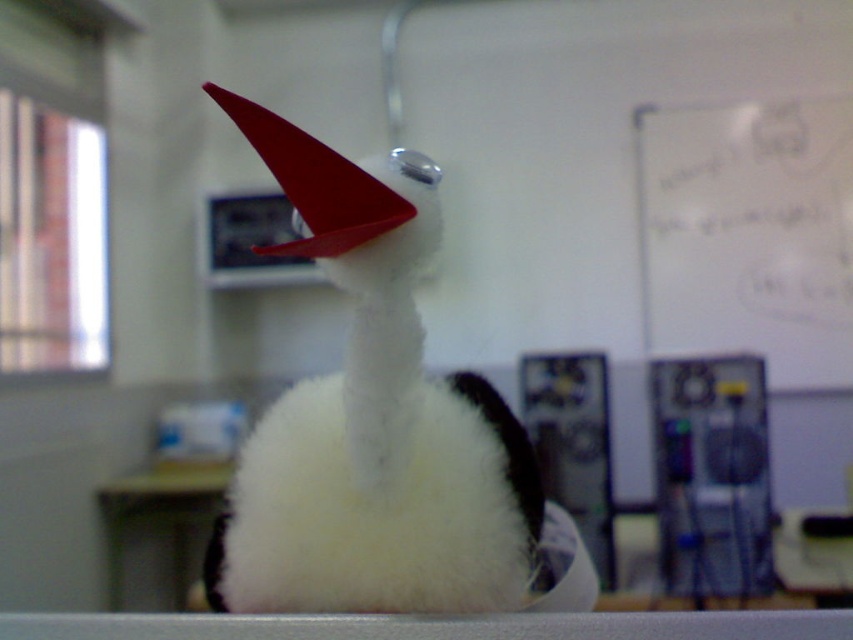
You are holding a camera and want to take a photo of the plush toy bird. The camera is currently at a position that is 17.16 inches away from the point labeled as point (460,544). Will the plush toy bird be in focus if you focus on that point?

Yes, the plush toy bird will be in focus if you focus on the point (460,544) because the camera is 17.16 inches away from that point, which is within the typical focusing range of most cameras.

You are a student in the classroom and want to place a sticker exactly at the center of the white fluffy fur at center. According to the coordinates provided, where should you place the sticker?

The sticker should be placed at the coordinates point (379, 509), which is the exact center of the white fluffy fur at center.

You are a student in the classroom and need to place a pencil case on the surface that can support it. Which object between the white fluffy fur at center and the white matte board at upper right is more suitable for placing the pencil case?

The white matte board at upper right is more suitable for placing the pencil case because the white fluffy fur at center is thinner and less stable compared to the white matte board at upper right.